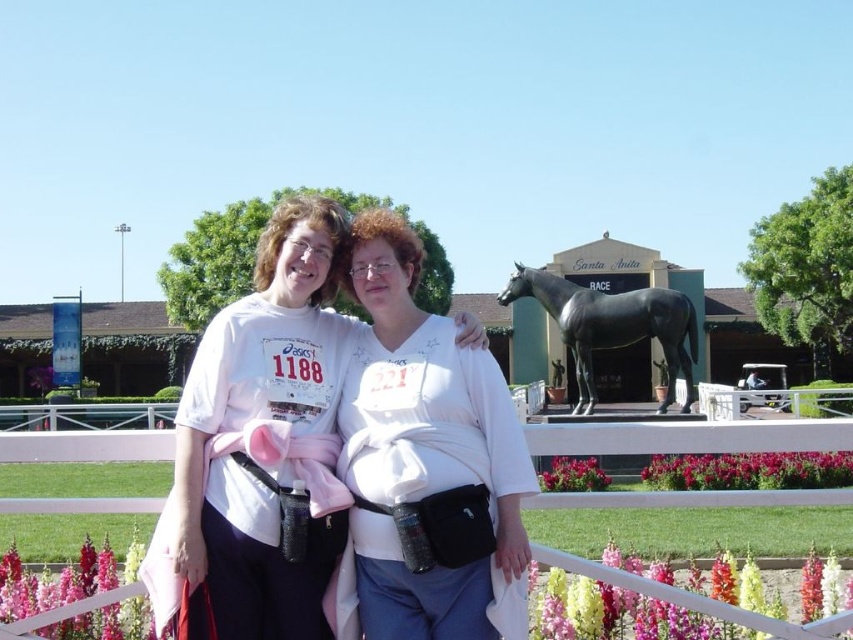
Consider the image. Does white plastic fence at center have a lesser height compared to black polished horse at center?

Correct, white plastic fence at center is not as tall as black polished horse at center.

Can you confirm if white plastic fence at center is taller than black polished horse at center?

No.

Locate an element on the screen. The width and height of the screenshot is (853, 640). white plastic fence at center is located at coordinates (689, 436).

At what (x,y) coordinates should I click in order to perform the action: click on white plastic fence at center. Please return your answer as a coordinate pair (x, y). Looking at the image, I should click on (689, 436).

Which of these two, white matte shirt at center or white plastic fence at center, stands shorter?

Standing shorter between the two is white plastic fence at center.

In the scene shown: Which is above, white matte shirt at center or white plastic fence at center?

white matte shirt at center is above.

Is point (334, 360) positioned before point (12, 627)?

No, it is not.

What are the coordinates of `white matte shirt at center` in the screenshot? It's located at (262, 448).

The height and width of the screenshot is (640, 853). What do you see at coordinates (262, 448) in the screenshot? I see `white matte shirt at center` at bounding box center [262, 448].

Which of these two, white matte shirt at center or black polished horse at center, stands shorter?

black polished horse at center

At what (x,y) coordinates should I click in order to perform the action: click on white matte shirt at center. Please return your answer as a coordinate pair (x, y). Looking at the image, I should click on (262, 448).